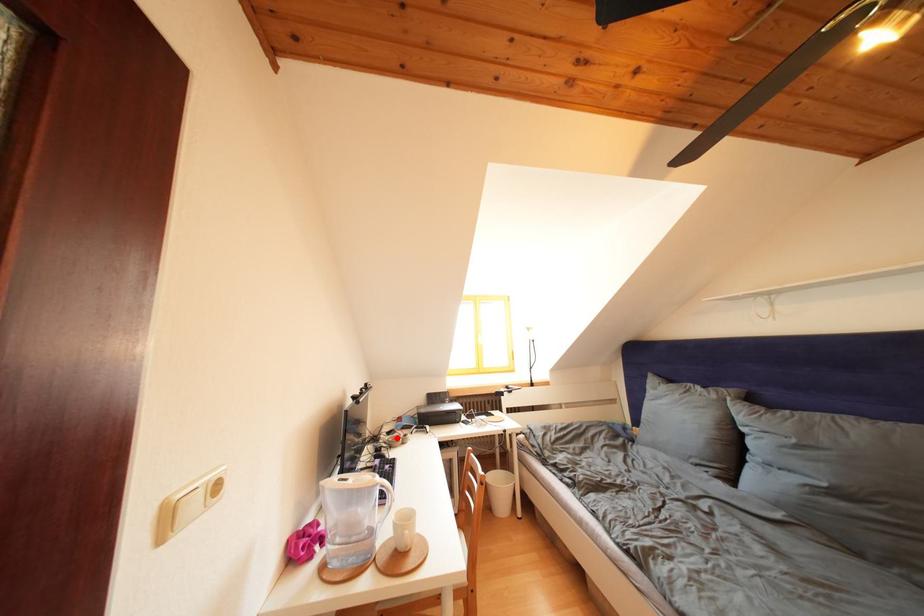
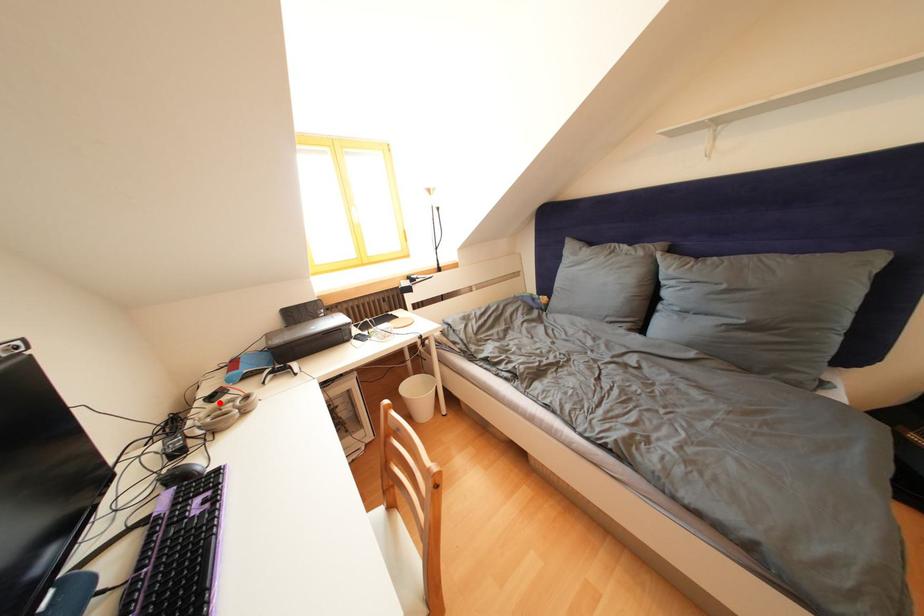
I am providing you with two images of the same scene from different viewpoints. A red point is marked on the first image and another point is marked on the second image. Is the marked point in image1 the same physical position as the marked point in image2?

Yes